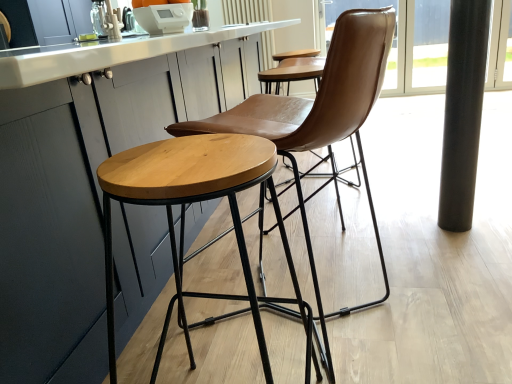
Question: Considering the positions of black polished pole at right and brown leather chair at center in the image, is black polished pole at right wider or thinner than brown leather chair at center?

Choices:
 (A) wide
 (B) thin

Answer: (B)

Question: In terms of height, does black polished pole at right look taller or shorter compared to brown leather chair at center?

Choices:
 (A) short
 (B) tall

Answer: (B)

Question: Based on their relative distances, which object is nearer to the black glass window screen at right?

Choices:
 (A) black polished pole at right
 (B) brown leather chair at center
 (C) white glossy countertop at center

Answer: (A)

Question: Considering the real-world distances, which object is closest to the black polished pole at right?

Choices:
 (A) black glass window screen at right
 (B) brown leather chair at center
 (C) white glossy countertop at center

Answer: (B)